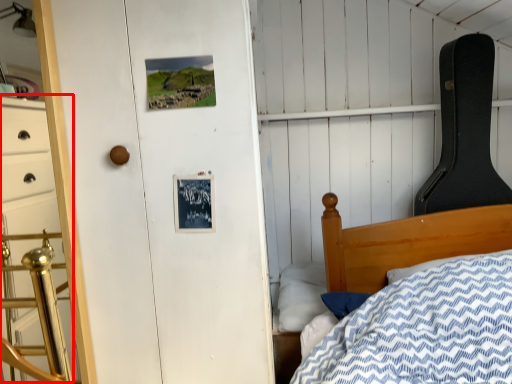
Question: From the image's perspective, what is the correct spatial relationship of dresser (annotated by the red box) in relation to pillow?

Choices:
 (A) above
 (B) below

Answer: (A)